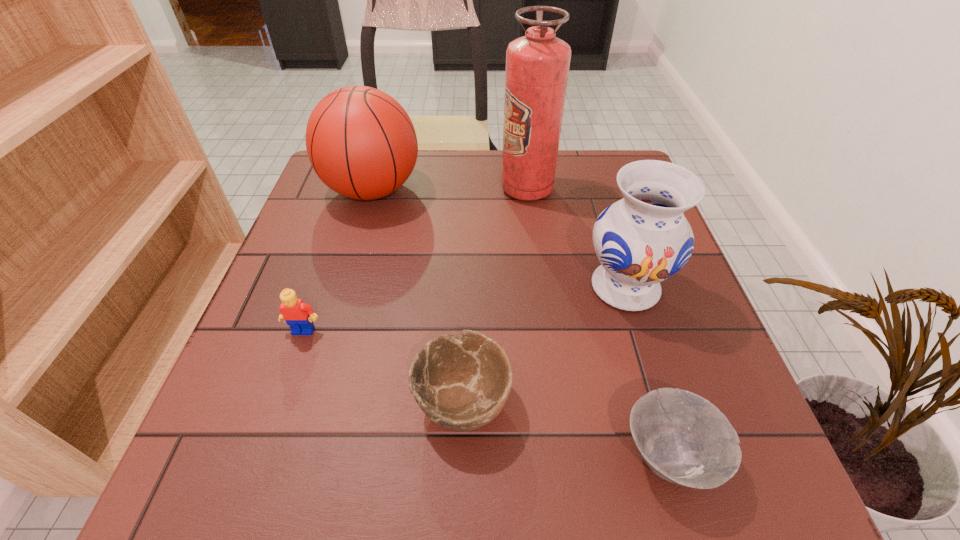
This screenshot has height=540, width=960. What are the coordinates of `free space that is in between the fifth tallest object and the basketball` in the screenshot? It's located at (418, 295).

I want to click on object that is the closest to the tallest object, so click(x=643, y=239).

Identify which object is located as the second nearest to the tallest object. Please provide its 2D coordinates. Your answer should be formatted as a tuple, i.e. [(x, y)], where the tuple contains the x and y coordinates of a point satisfying the conditions above.

[(360, 141)]

Identify the location of free space in the image that satisfies the following two spatial constraints: 1. on the face of the third object from left to right; 2. on the right side of the fourth tallest object. (279, 400).

The image size is (960, 540). Identify the location of free space that satisfies the following two spatial constraints: 1. on the front side of the vase; 2. on the right side of the basketball. (345, 287).

I want to click on free space that satisfies the following two spatial constraints: 1. on the front side of the basketball; 2. on the left side of the shorter bowl, so click(x=296, y=455).

Where is `vacant space that satisfies the following two spatial constraints: 1. on the face of the Lego; 2. on the right side of the taller bowl`? The image size is (960, 540). vacant space that satisfies the following two spatial constraints: 1. on the face of the Lego; 2. on the right side of the taller bowl is located at coordinates (279, 400).

Locate an element on the screen. The image size is (960, 540). vacant space that satisfies the following two spatial constraints: 1. on the label side of the third object from right to left; 2. on the face of the third nearest object is located at coordinates (544, 330).

This screenshot has width=960, height=540. In order to click on free location that satisfies the following two spatial constraints: 1. on the face of the third shortest object; 2. on the left side of the shortest object in this screenshot , I will do click(x=260, y=455).